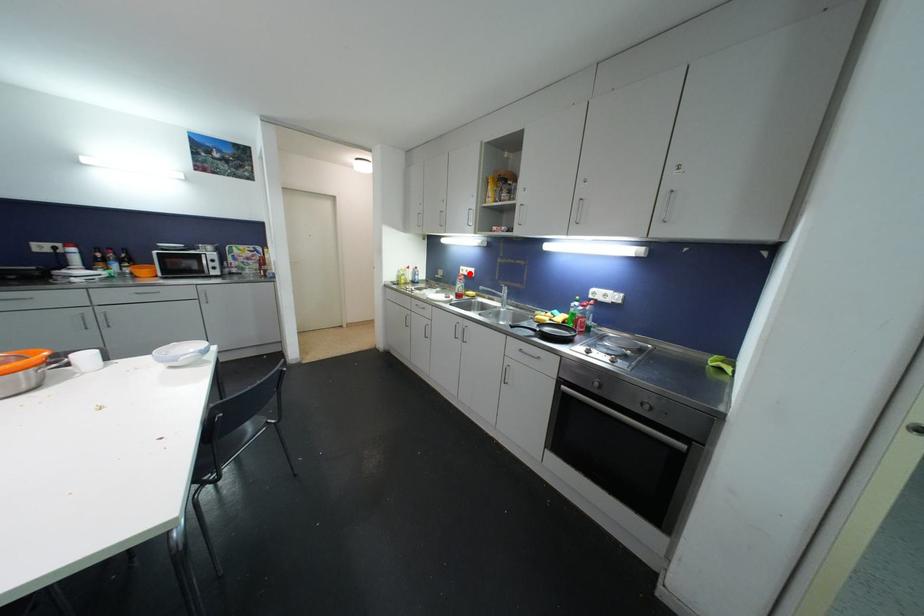
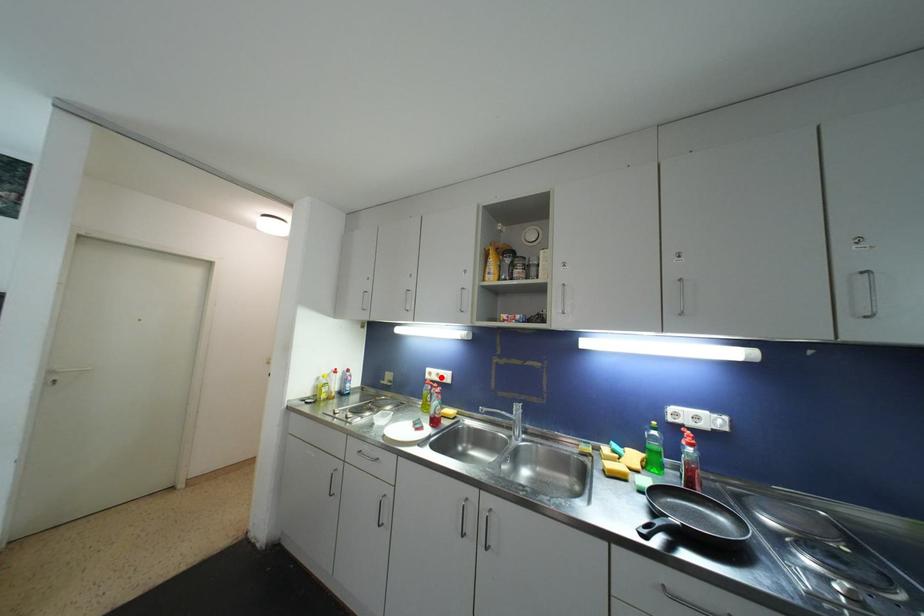
I am providing you with two images of the same scene from different viewpoints. A red point is marked on the first image and another point is marked on the second image. Do the highlighted points in image1 and image2 indicate the same real-world spot?

Yes